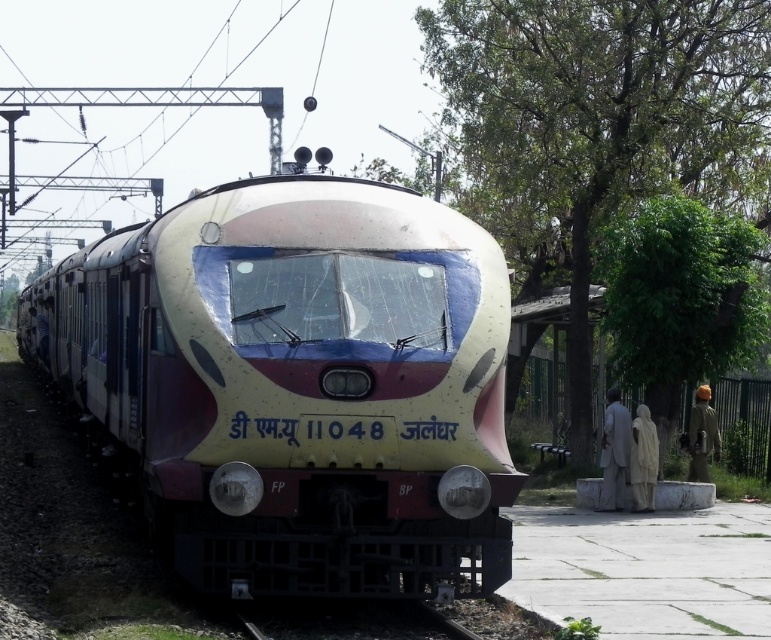
Which is more to the right, white glossy train at center or light gray fabric statue at right?

From the viewer's perspective, light gray fabric statue at right appears more on the right side.

Does point (150, 365) come in front of point (621, 426)?

Yes, point (150, 365) is closer to viewer.

Is point (443, 500) closer to camera compared to point (611, 472)?

Yes, it is in front of point (611, 472).

Where is `white glossy train at center`? white glossy train at center is located at coordinates (298, 385).

Between white glossy train at center and brown fabric turban at right, which one has less height?

brown fabric turban at right

Is white glossy train at center shorter than brown fabric turban at right?

No, white glossy train at center is not shorter than brown fabric turban at right.

At what (x,y) coordinates should I click in order to perform the action: click on white glossy train at center. Please return your answer as a coordinate pair (x, y). This screenshot has width=771, height=640. Looking at the image, I should click on (298, 385).

The image size is (771, 640). In order to click on white glossy train at center in this screenshot , I will do `click(298, 385)`.

Between white glossy train at center and white fabric at right, which one has more height?

white glossy train at center

Measure the distance from white glossy train at center to white fabric at right.

The distance of white glossy train at center from white fabric at right is 8.93 meters.

Who is more forward, (216, 451) or (642, 436)?

Point (216, 451) is in front.

Locate an element on the screen. The image size is (771, 640). white glossy train at center is located at coordinates (298, 385).